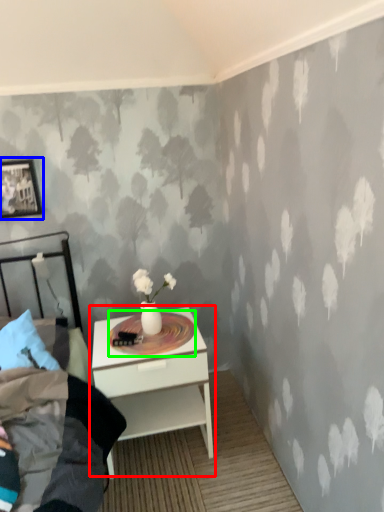
Question: Based on their relative distances, which object is farther from nightstand (highlighted by a red box)? Choose from picture frame (highlighted by a blue box) and round table (highlighted by a green box).

Choices:
 (A) picture frame
 (B) round table

Answer: (A)